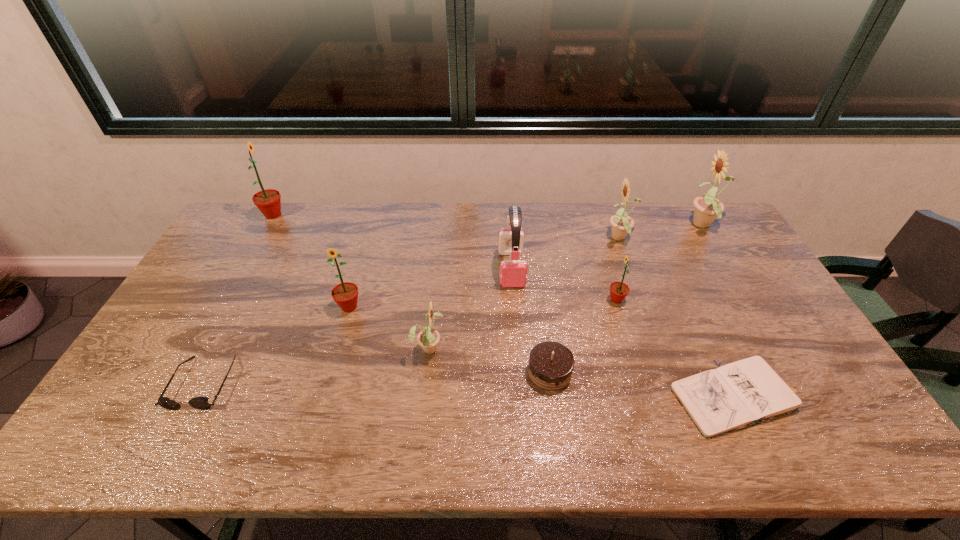
Where is `the rightmost sunflower`? The height and width of the screenshot is (540, 960). the rightmost sunflower is located at coordinates (707, 208).

I want to click on the rightmost yellow sunflower, so click(707, 208).

Find the location of a particular element. This screenshot has width=960, height=540. the leftmost sunflower is located at coordinates (268, 201).

Identify the location of the leftmost green sunflower. This screenshot has height=540, width=960. (268, 201).

The image size is (960, 540). Find the location of `the second yellow sunflower from right to left`. the second yellow sunflower from right to left is located at coordinates (622, 224).

You are a GUI agent. You are given a task and a screenshot of the screen. Output one action in this format:
    pyautogui.click(x=<x>, y=<y>)
    Task: Click on the third object from left to right
    
    Given the screenshot: What is the action you would take?
    pyautogui.click(x=345, y=294)

What are the coordinates of `the second sunflower from left to right` in the screenshot? It's located at (345, 294).

Locate an element on the screen. the fourth farthest object is located at coordinates (512, 273).

The width and height of the screenshot is (960, 540). I want to click on earphone, so click(512, 273).

Image resolution: width=960 pixels, height=540 pixels. In order to click on the third sunflower from left to right in this screenshot , I will do `click(428, 338)`.